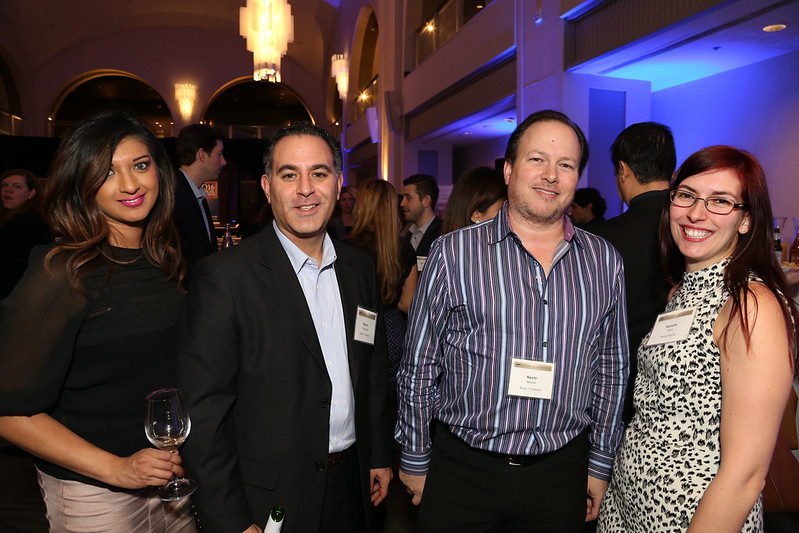
Identify the location of wall light. The height and width of the screenshot is (533, 799). (185, 88), (336, 72).